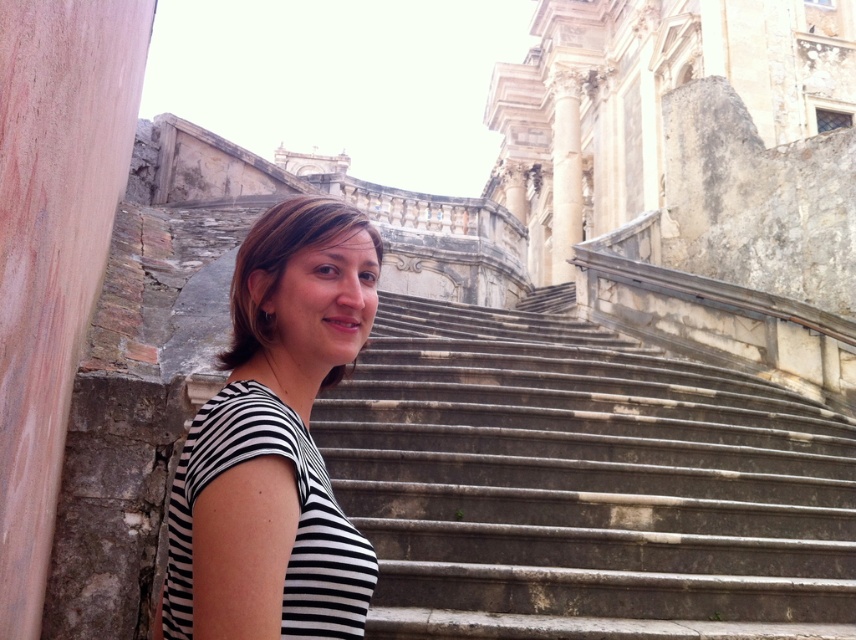
Question: Which point is farther to the camera?

Choices:
 (A) (849, 506)
 (B) (253, 324)

Answer: (A)

Question: Considering the relative positions of stone stairs at center and white marble column at upper center in the image provided, where is stone stairs at center located with respect to white marble column at upper center?

Choices:
 (A) right
 (B) left

Answer: (B)

Question: Which object appears farthest from the camera in this image?

Choices:
 (A) black striped shirt at center
 (B) stone stairs at center
 (C) white marble column at upper center

Answer: (C)

Question: Is black striped shirt at center above white marble column at upper center?

Choices:
 (A) no
 (B) yes

Answer: (A)

Question: Considering the real-world distances, which object is farthest from the black striped shirt at center?

Choices:
 (A) stone stairs at center
 (B) white marble column at upper center

Answer: (B)

Question: Does stone stairs at center appear under white marble column at upper center?

Choices:
 (A) yes
 (B) no

Answer: (A)